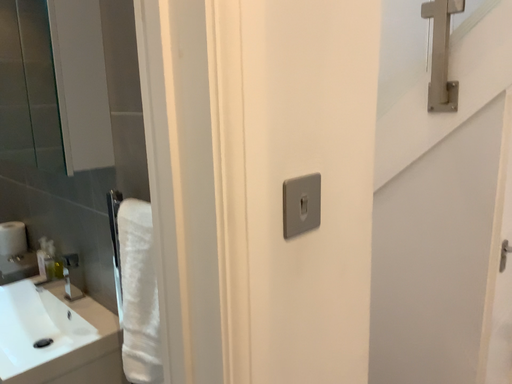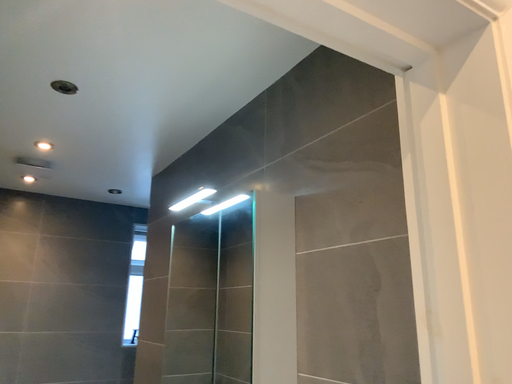
Question: Which way did the camera rotate in the video?

Choices:
 (A) rotated right
 (B) rotated left

Answer: (B)